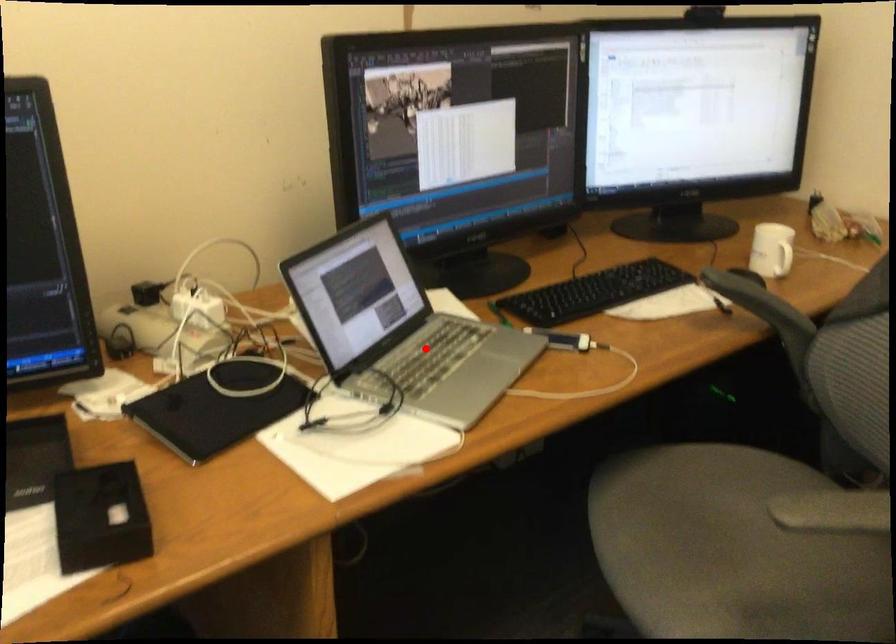
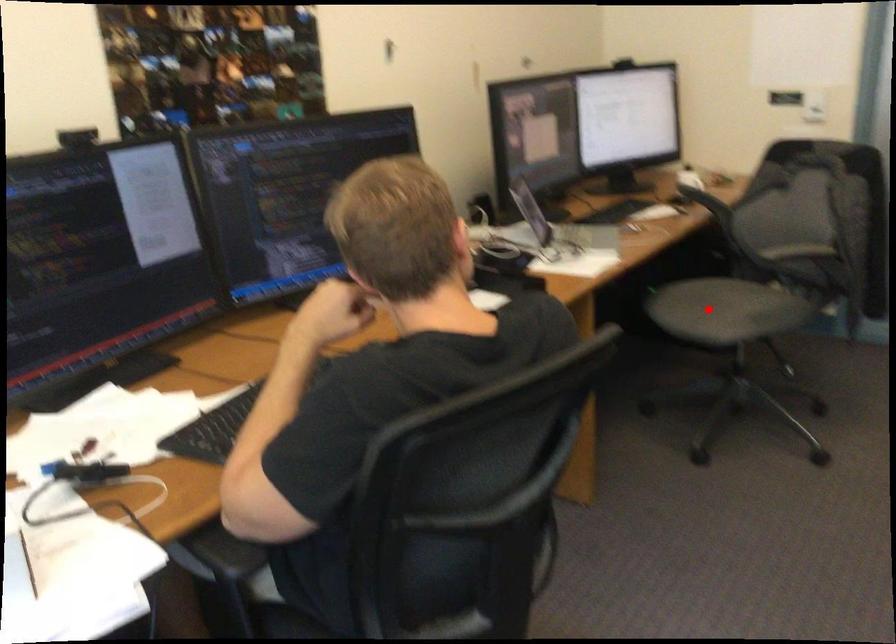
In the scene shown: I am providing you with two images of the same scene from different viewpoints. A red point is marked on the first image and another point is marked on the second image. Is the marked point in image1 the same physical position as the marked point in image2?

No